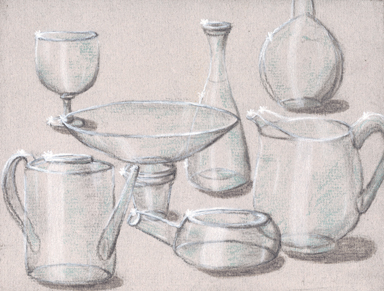
Find the location of a particular element. glass is located at coordinates (70, 65), (129, 133), (60, 213), (228, 156), (229, 234), (287, 73), (291, 152).